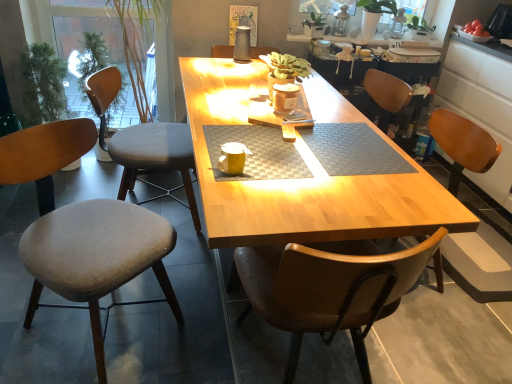
The width and height of the screenshot is (512, 384). I want to click on unoccupied region to the right of yellow matte coffee cup at center, so coord(273,166).